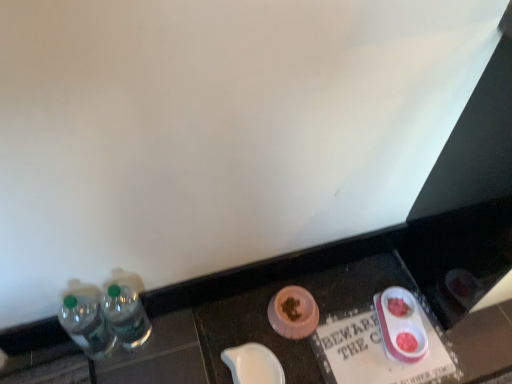
Question: Should I look upward or downward to see clear plastic bottles at left, which is counted as the first bottle, starting from the right?

Choices:
 (A) up
 (B) down

Answer: (B)

Question: Is white paper sign at lower center at the back of clear plastic bottles at left, positioned as the second bottle in right-to-left order?

Choices:
 (A) no
 (B) yes

Answer: (A)

Question: Does clear plastic bottles at left, positioned as the second bottle in right-to-left order, have a smaller size compared to white paper sign at lower center?

Choices:
 (A) no
 (B) yes

Answer: (A)

Question: Considering the relative positions of clear plastic bottles at left, the 1th bottle viewed from the left, and white paper sign at lower center in the image provided, is clear plastic bottles at left, the 1th bottle viewed from the left, behind white paper sign at lower center?

Choices:
 (A) no
 (B) yes

Answer: (A)

Question: Is clear plastic bottles at left, the 1th bottle viewed from the left, in contact with white paper sign at lower center?

Choices:
 (A) no
 (B) yes

Answer: (A)

Question: Would you say clear plastic bottles at left, positioned as the second bottle in right-to-left order, is outside white paper sign at lower center?

Choices:
 (A) yes
 (B) no

Answer: (A)

Question: Does clear plastic bottles at left, the 1th bottle viewed from the left, appear on the right side of white paper sign at lower center?

Choices:
 (A) no
 (B) yes

Answer: (A)

Question: Is the depth of white glossy bowl at lower center, the 2th tableware positioned from the right, less than that of pink plastic food bowls at lower right, arranged as the 1th tableware when viewed from the right?

Choices:
 (A) yes
 (B) no

Answer: (A)

Question: Does white glossy bowl at lower center, the first tableware in the left-to-right sequence, have a greater width compared to pink plastic food bowls at lower right, placed as the second tableware when sorted from left to right?

Choices:
 (A) no
 (B) yes

Answer: (A)

Question: From the image's perspective, is white glossy bowl at lower center, the 2th tableware positioned from the right, on pink plastic food bowls at lower right, arranged as the 1th tableware when viewed from the right?

Choices:
 (A) no
 (B) yes

Answer: (A)

Question: Does white glossy bowl at lower center, the first tableware in the left-to-right sequence, have a lesser width compared to pink plastic food bowls at lower right, placed as the second tableware when sorted from left to right?

Choices:
 (A) no
 (B) yes

Answer: (B)

Question: Does white glossy bowl at lower center, the first tableware in the left-to-right sequence, turn towards pink plastic food bowls at lower right, placed as the second tableware when sorted from left to right?

Choices:
 (A) no
 (B) yes

Answer: (A)

Question: Does white glossy bowl at lower center, the first tableware in the left-to-right sequence, have a lesser height compared to pink plastic food bowls at lower right, placed as the second tableware when sorted from left to right?

Choices:
 (A) yes
 (B) no

Answer: (A)

Question: Could clear plastic bottles at left be considered to be inside clear plastic bottles at left, the 2th bottle viewed from the left?

Choices:
 (A) yes
 (B) no

Answer: (B)